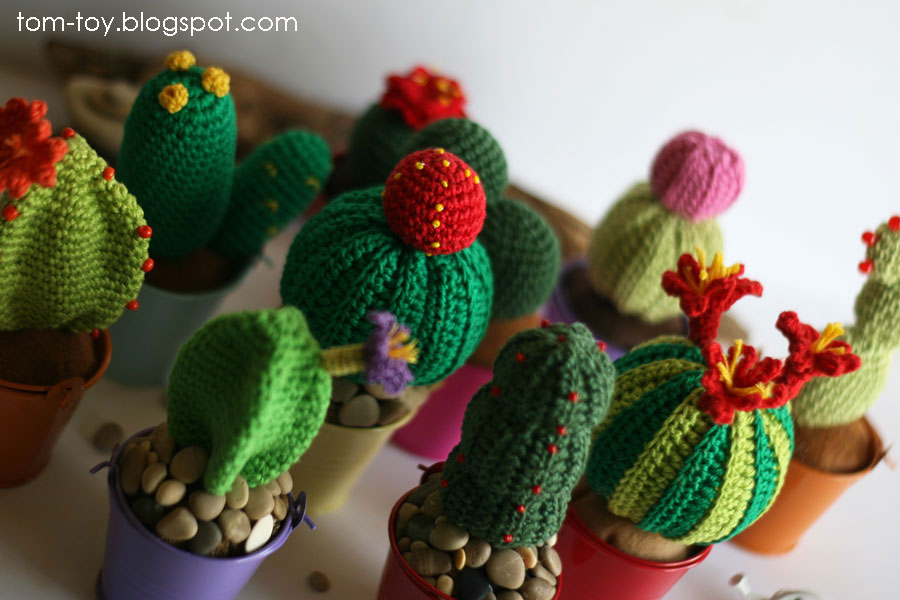
Find the location of `pink pot`. pink pot is located at coordinates (450, 428).